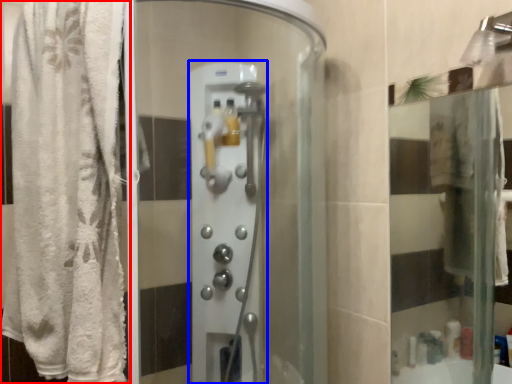
Question: Which object is closer to the camera taking this photo, curtain (highlighted by a red box) or screen door (highlighted by a blue box)?

Choices:
 (A) curtain
 (B) screen door

Answer: (A)